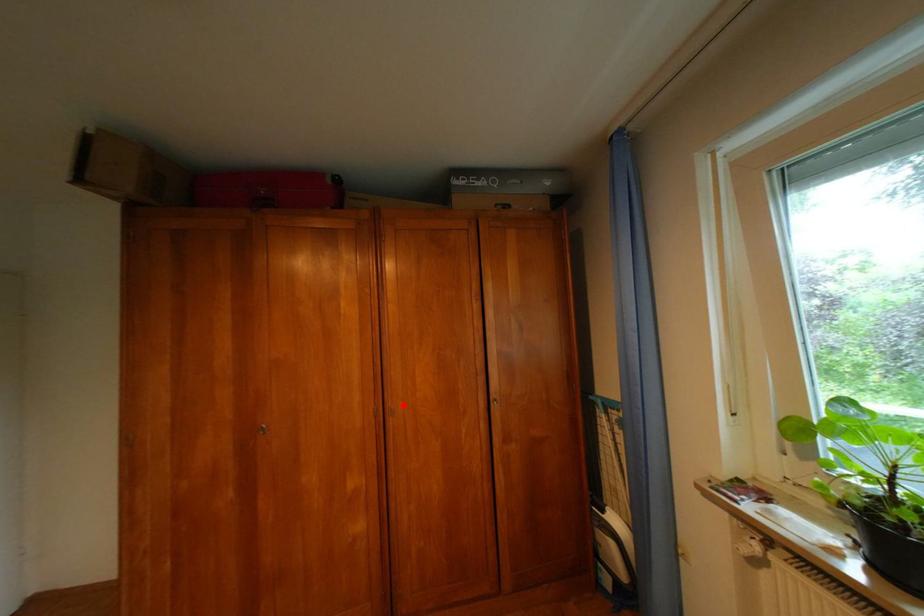
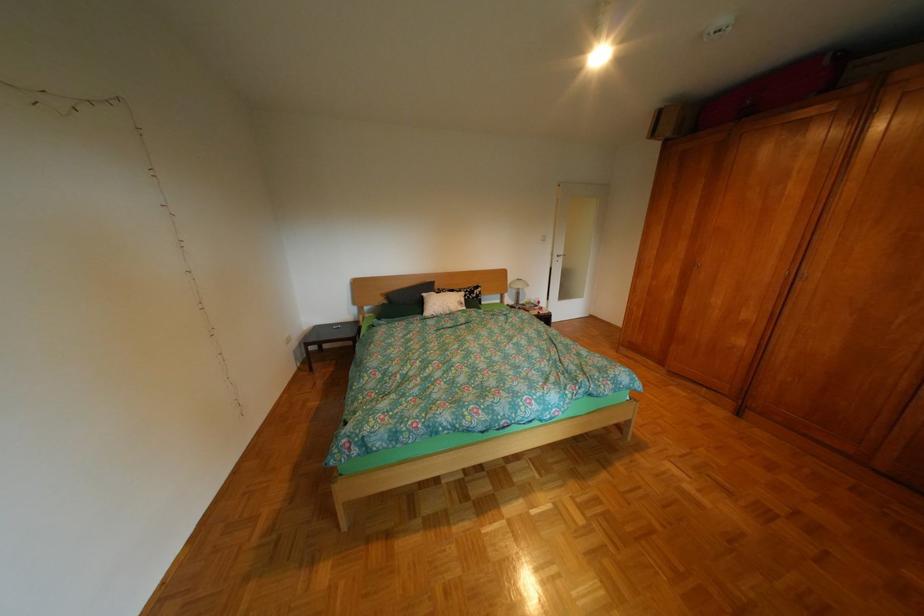
Find the pixel in the second image that matches the highlighted location in the first image.

(819, 273)